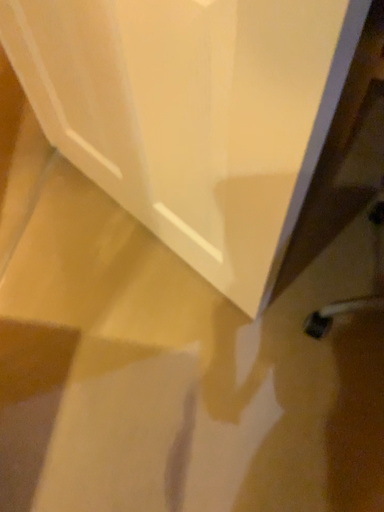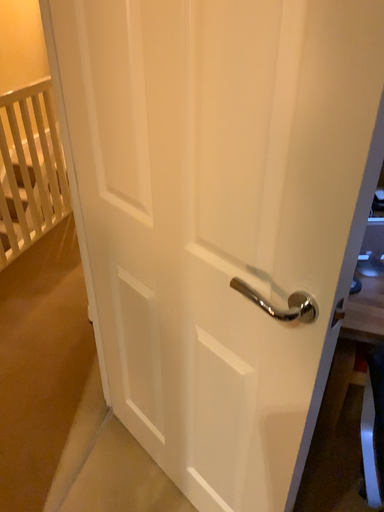
Question: How did the camera likely rotate when shooting the video?

Choices:
 (A) rotated upward
 (B) rotated downward

Answer: (A)